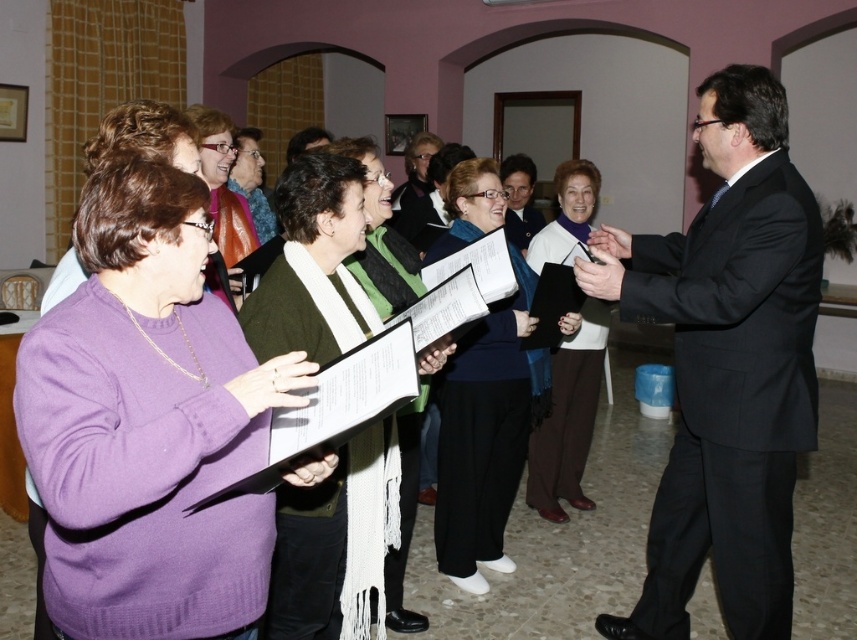
Who is more distant from viewer, (x=142, y=458) or (x=514, y=179)?

Point (x=514, y=179)

Can you confirm if purple knit sweater at center is positioned above matte black suit at center?

No, purple knit sweater at center is not above matte black suit at center.

The width and height of the screenshot is (857, 640). I want to click on purple knit sweater at center, so click(147, 424).

Locate an element on the screen. purple knit sweater at center is located at coordinates (147, 424).

Consider the image. Between purple knit sweater at center and matte purple sweater at upper left, which one appears on the right side from the viewer's perspective?

purple knit sweater at center

Looking at this image, which of these two, purple knit sweater at center or matte purple sweater at upper left, stands taller?

purple knit sweater at center

Image resolution: width=857 pixels, height=640 pixels. I want to click on purple knit sweater at center, so click(x=147, y=424).

Between black suit at right and matte green scarf at center, which one is positioned lower?

black suit at right is lower down.

Can you confirm if black suit at right is wider than matte green scarf at center?

Yes, black suit at right is wider than matte green scarf at center.

Between point (694, 381) and point (243, 195), which one is positioned in front?

Positioned in front is point (694, 381).

Locate an element on the screen. black suit at right is located at coordinates (726, 364).